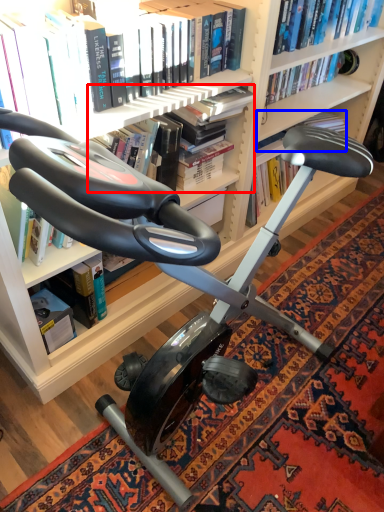
Question: Among these objects, which one is nearest to the camera, book (highlighted by a red box) or book (highlighted by a blue box)?

Choices:
 (A) book
 (B) book

Answer: (A)